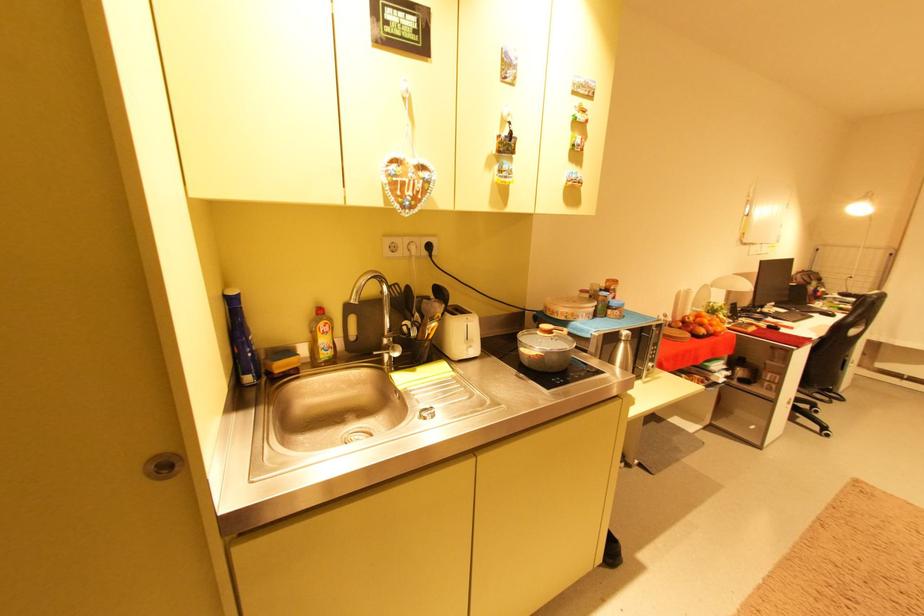
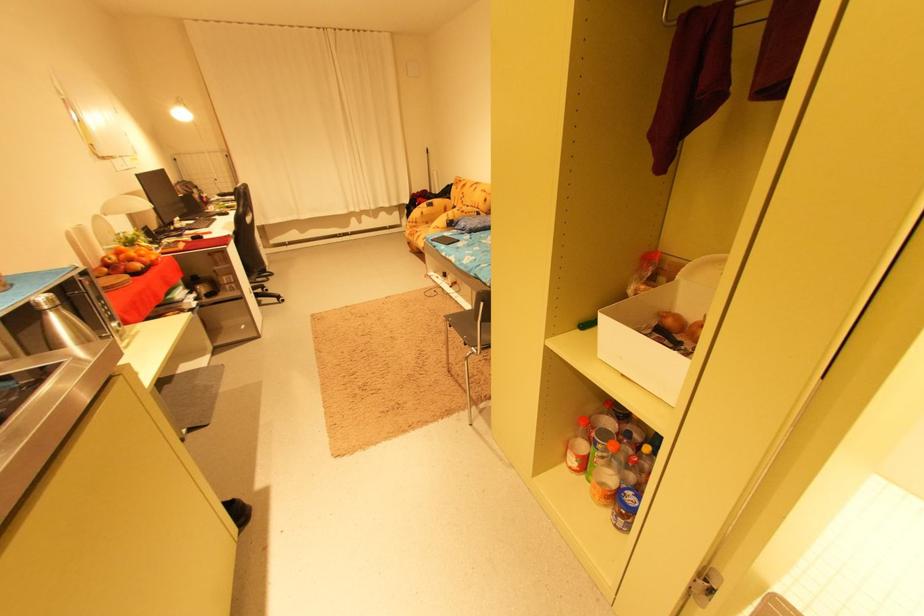
In the second image, find the point that corresponds to (x=707, y=320) in the first image.

(129, 257)